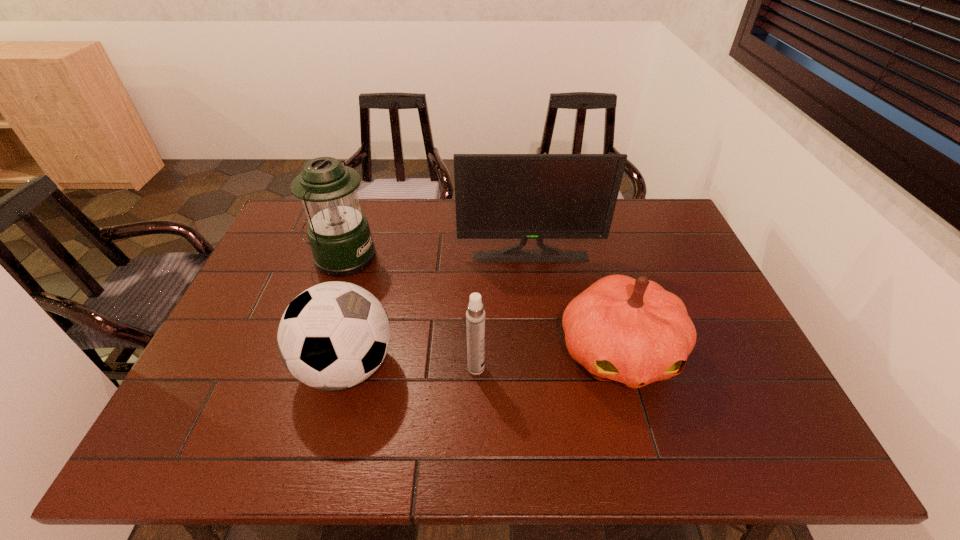
Where is `object located in the far edge section of the desktop`? The height and width of the screenshot is (540, 960). object located in the far edge section of the desktop is located at coordinates (339, 235).

Where is `object that is at the left edge`? The height and width of the screenshot is (540, 960). object that is at the left edge is located at coordinates (339, 235).

This screenshot has height=540, width=960. In order to click on object that is positioned at the far left corner in this screenshot , I will do `click(339, 235)`.

Where is `vacant space at the far edge`? This screenshot has height=540, width=960. vacant space at the far edge is located at coordinates (421, 232).

In order to click on vacant space at the near edge of the desktop in this screenshot , I will do `click(451, 448)`.

Identify the location of vacant space at the left edge of the desktop. The image size is (960, 540). (237, 327).

Identify the location of vacant area at the near left corner. (228, 436).

The height and width of the screenshot is (540, 960). I want to click on vacant space at the far right corner of the desktop, so click(x=649, y=226).

Locate an element on the screen. free point between the pumpkin and the aerosol can is located at coordinates (547, 360).

Identify the location of free space between the aerosol can and the lantern. This screenshot has width=960, height=540. (410, 313).